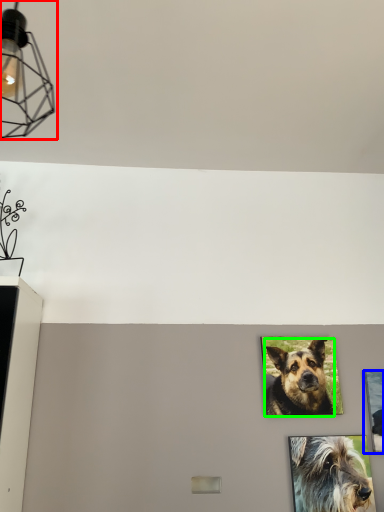
Question: Estimate the real-world distances between objects in this image. Which object is closer to light fixture (highlighted by a red box), picture frame (highlighted by a blue box) or dog (highlighted by a green box)?

Choices:
 (A) picture frame
 (B) dog

Answer: (B)